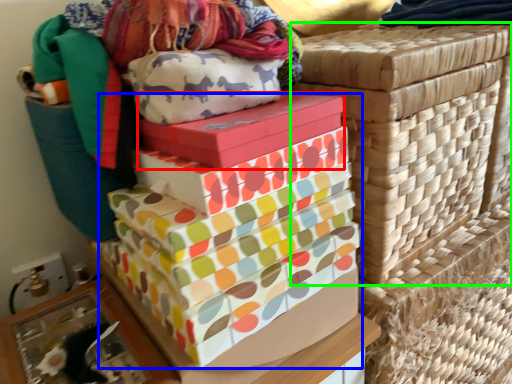
Question: Estimate the real-world distances between objects in this image. Which object is closer to gift box (highlighted by a red box), gift box (highlighted by a blue box) or basket container (highlighted by a green box)?

Choices:
 (A) gift box
 (B) basket container

Answer: (A)